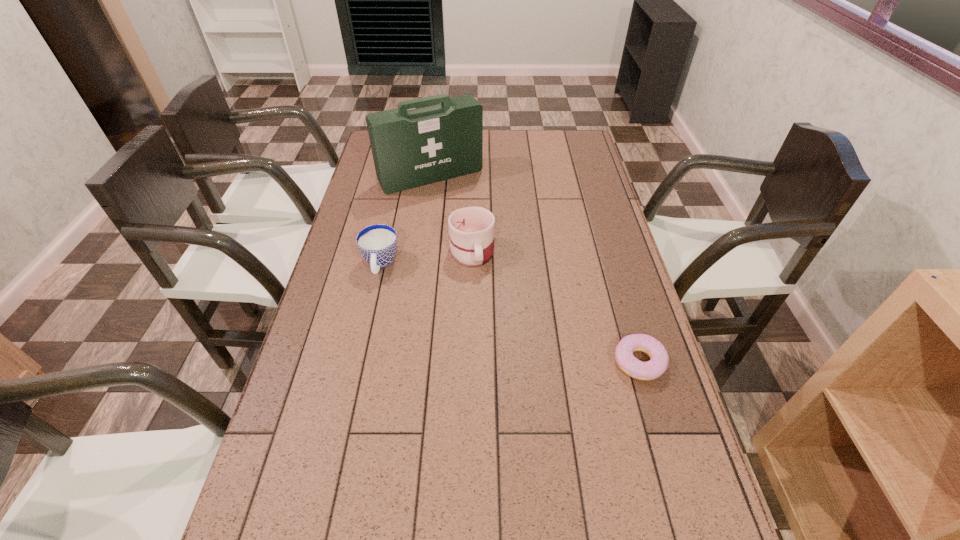
The image size is (960, 540). Identify the location of the third tallest object. (377, 243).

This screenshot has width=960, height=540. I want to click on the rightmost object, so click(x=657, y=365).

This screenshot has width=960, height=540. I want to click on the shortest object, so click(x=657, y=365).

Identify the location of the farthest object. The height and width of the screenshot is (540, 960). tap(411, 148).

This screenshot has height=540, width=960. Identify the location of the first-aid kit. (411, 148).

Image resolution: width=960 pixels, height=540 pixels. In order to click on mug in this screenshot , I will do `click(471, 229)`.

In order to click on blank area located on the side of the third tallest object with the handle in this screenshot , I will do `click(358, 367)`.

Find the location of a particular element. This screenshot has width=960, height=540. vacant space located on the left of the rightmost object is located at coordinates (565, 362).

This screenshot has height=540, width=960. In order to click on vacant area situated on the front-facing side of the first-aid kit in this screenshot , I will do `click(492, 254)`.

Where is `vacant point located on the front-facing side of the first-aid kit`? The height and width of the screenshot is (540, 960). vacant point located on the front-facing side of the first-aid kit is located at coordinates (494, 256).